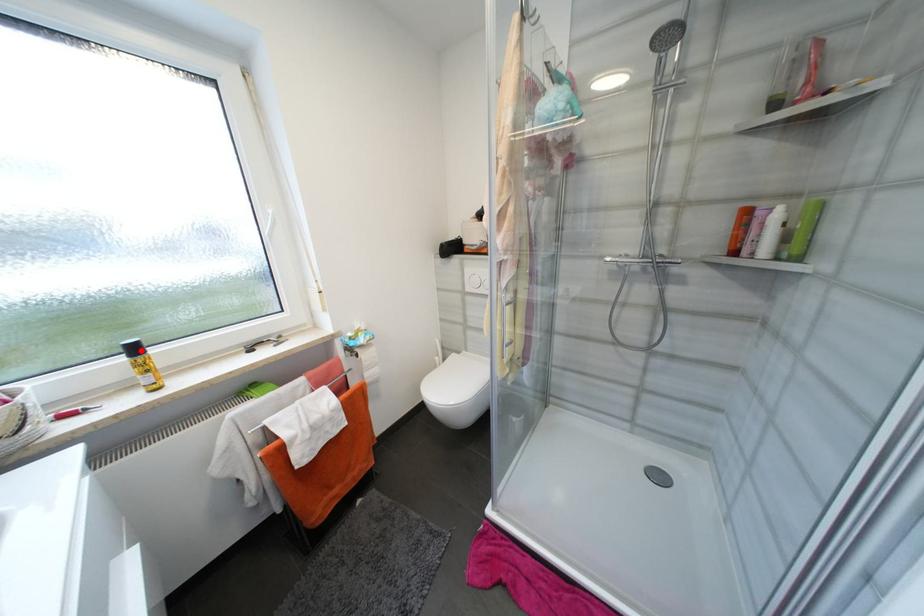
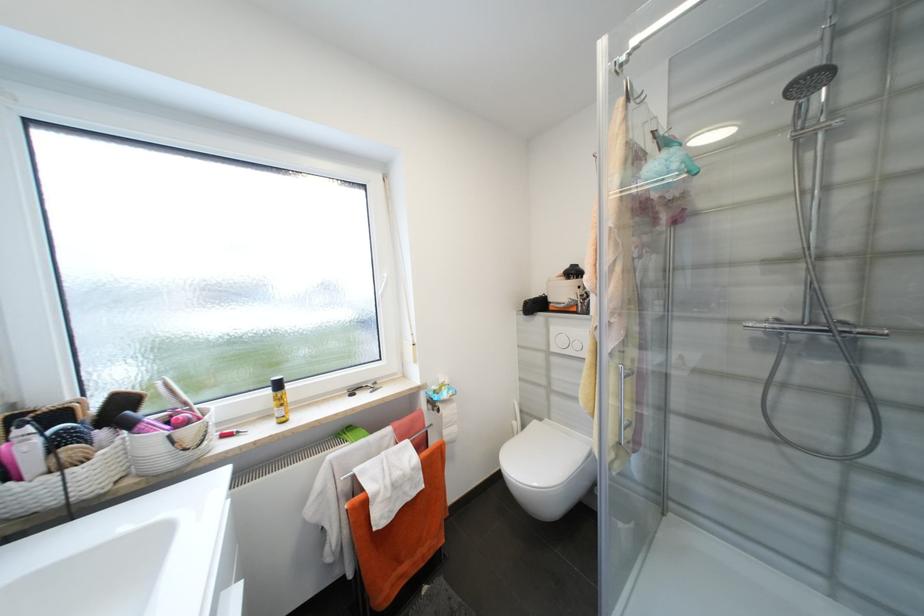
The point at the highlighted location is marked in the first image. Where is the corresponding point in the second image?

(284, 386)